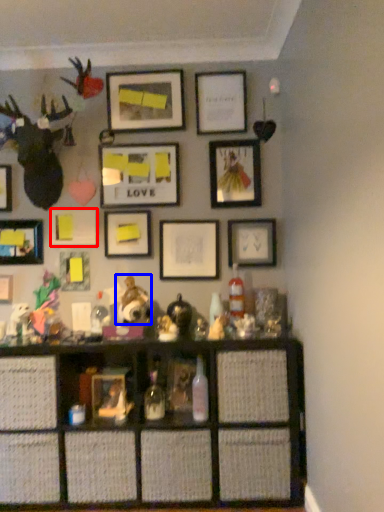
Question: Which object appears farthest to the camera in this image, picture frame (highlighted by a red box) or toy (highlighted by a blue box)?

Choices:
 (A) picture frame
 (B) toy

Answer: (A)